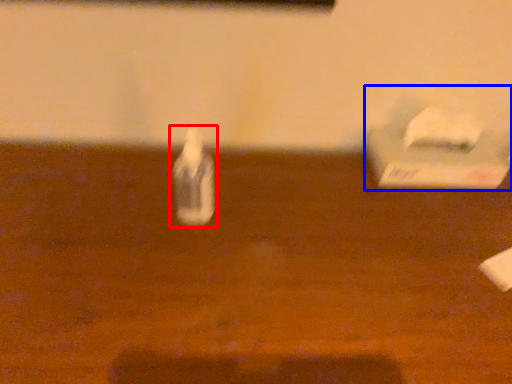
Question: Among these objects, which one is nearest to the camera, bottle (highlighted by a red box) or box (highlighted by a blue box)?

Choices:
 (A) bottle
 (B) box

Answer: (A)